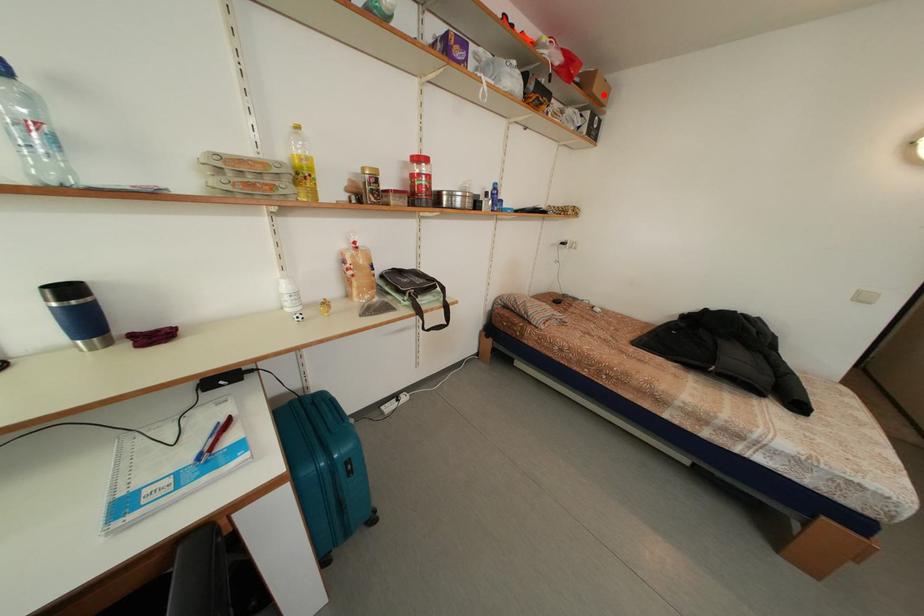
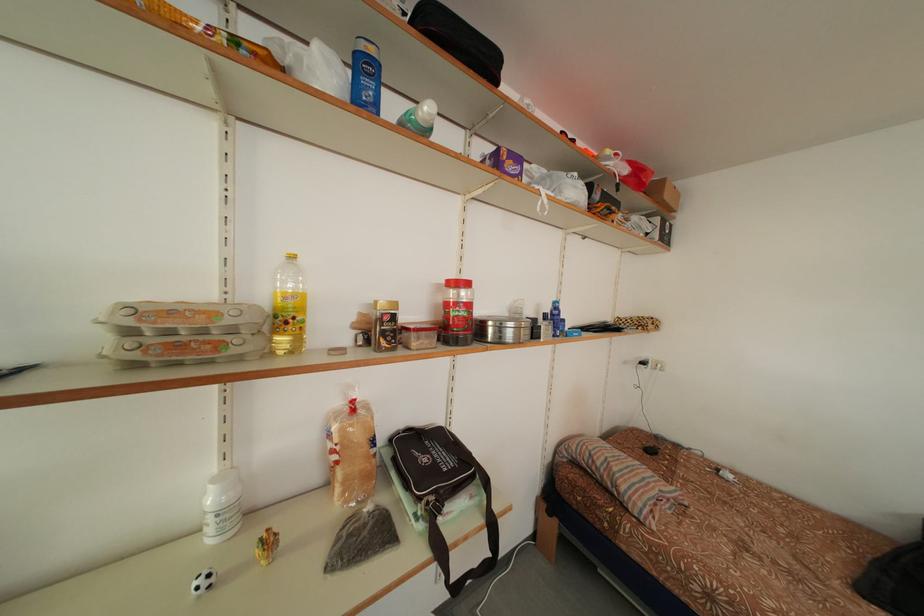
Locate, in the second image, the point that corresponds to the highlighted location in the first image.

(675, 201)